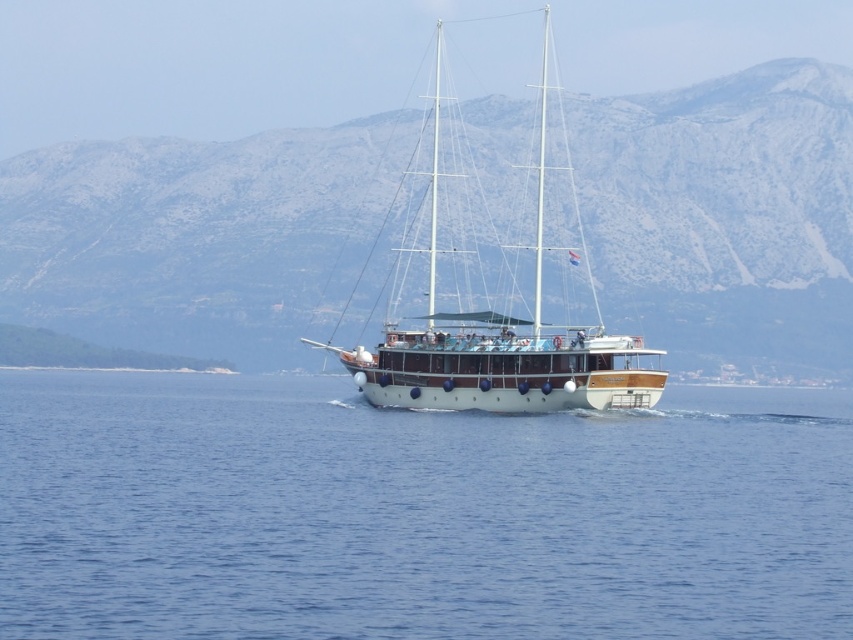
Who is lower down, gray rocky mountain at center or white polished wood sailboat at center?

white polished wood sailboat at center is below.

Between gray rocky mountain at center and white polished wood sailboat at center, which one appears on the right side from the viewer's perspective?

Positioned to the right is white polished wood sailboat at center.

Which is in front, point (35, 172) or point (399, 400)?

Point (399, 400) is in front.

The image size is (853, 640). Identify the location of gray rocky mountain at center. (195, 236).

Is blue water at center taller than gray rocky mountain at center?

In fact, blue water at center may be shorter than gray rocky mountain at center.

Is point (296, 593) positioned after point (616, 192)?

No, it is in front of (616, 192).

This screenshot has height=640, width=853. What are the coordinates of `blue water at center` in the screenshot? It's located at (416, 513).

Between point (219, 605) and point (436, 90), which one is positioned behind?

The point (436, 90) is behind.

Is blue water at center taller than white polished wood sailboat at center?

In fact, blue water at center may be shorter than white polished wood sailboat at center.

Who is more distant from viewer, (158, 412) or (607, 378)?

The point (158, 412) is more distant.

You are a GUI agent. You are given a task and a screenshot of the screen. Output one action in this format:
    pyautogui.click(x=<x>, y=<y>)
    Task: Click on the blue water at center
    This screenshot has width=853, height=640.
    Given the screenshot: What is the action you would take?
    pyautogui.click(x=416, y=513)